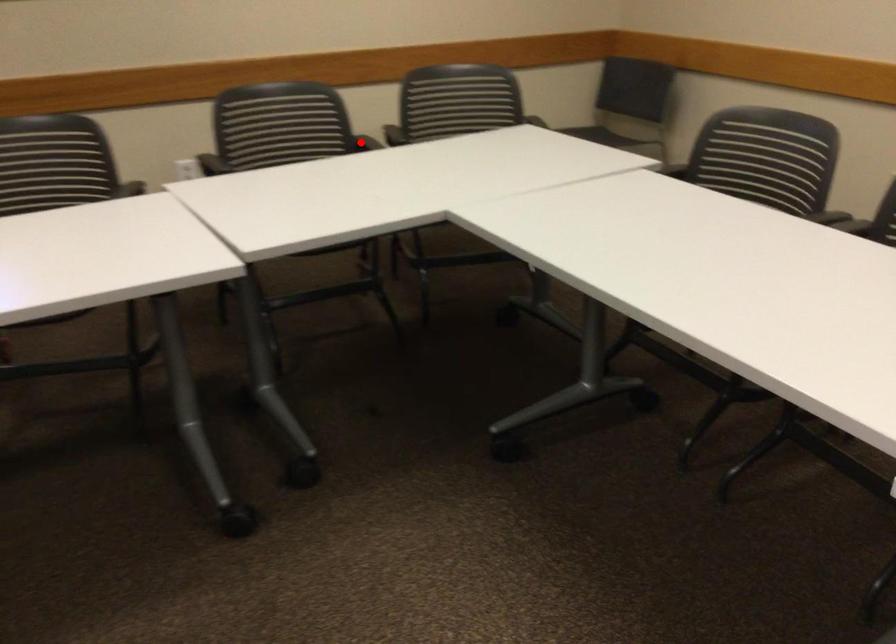
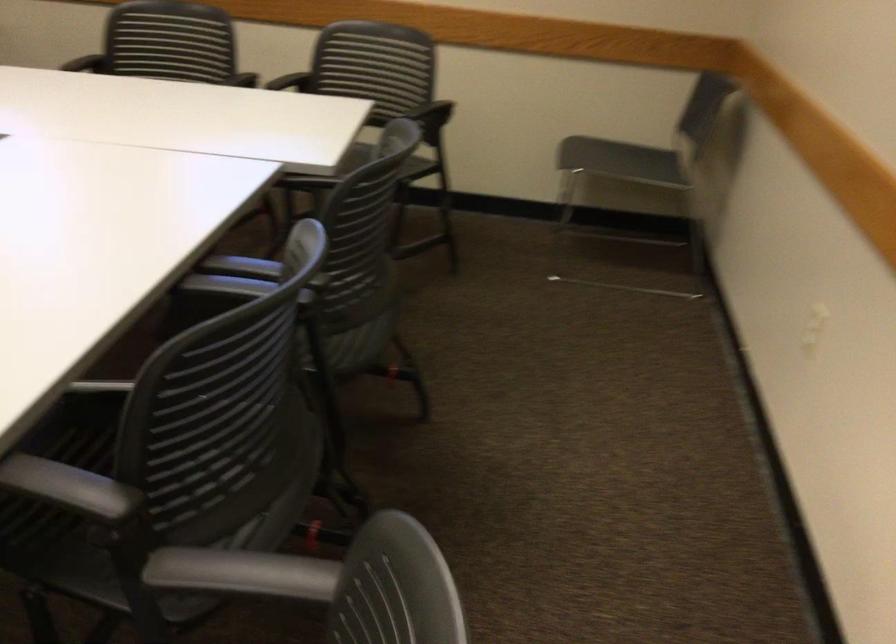
Question: I am providing you with two images of the same scene from different viewpoints. A red point is marked on the first image. At the location where the point appears in image 1, is it still visible in image 2?

Choices:
 (A) Yes
 (B) No

Answer: (B)